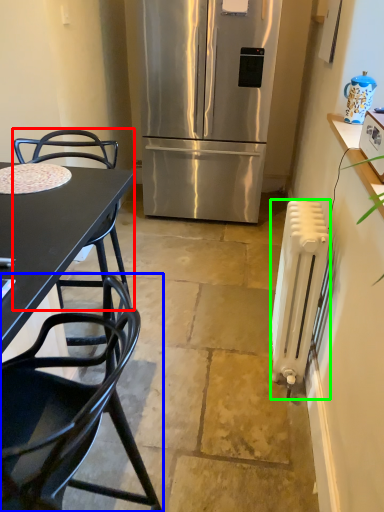
Question: Estimate the real-world distances between objects in this image. Which object is closer to chair (highlighted by a red box), chair (highlighted by a blue box) or radiator (highlighted by a green box)?

Choices:
 (A) chair
 (B) radiator

Answer: (B)